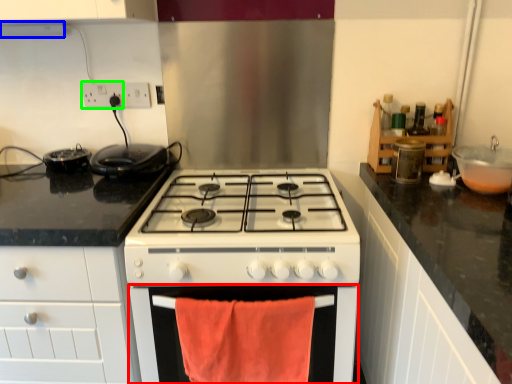
Question: Which is nearer to the oven (highlighted by a red box)? exhaust hood (highlighted by a blue box) or electric outlet (highlighted by a green box).

Choices:
 (A) exhaust hood
 (B) electric outlet

Answer: (B)